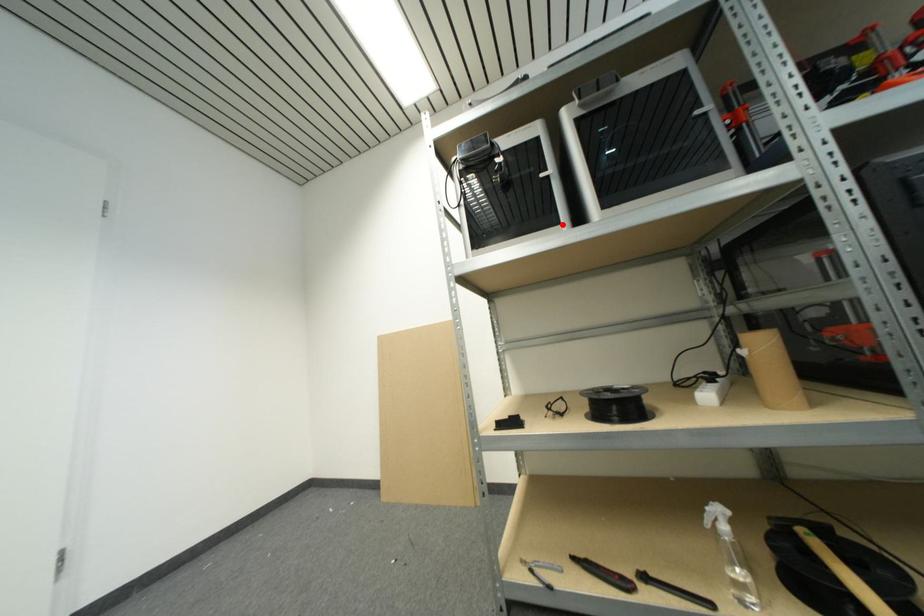
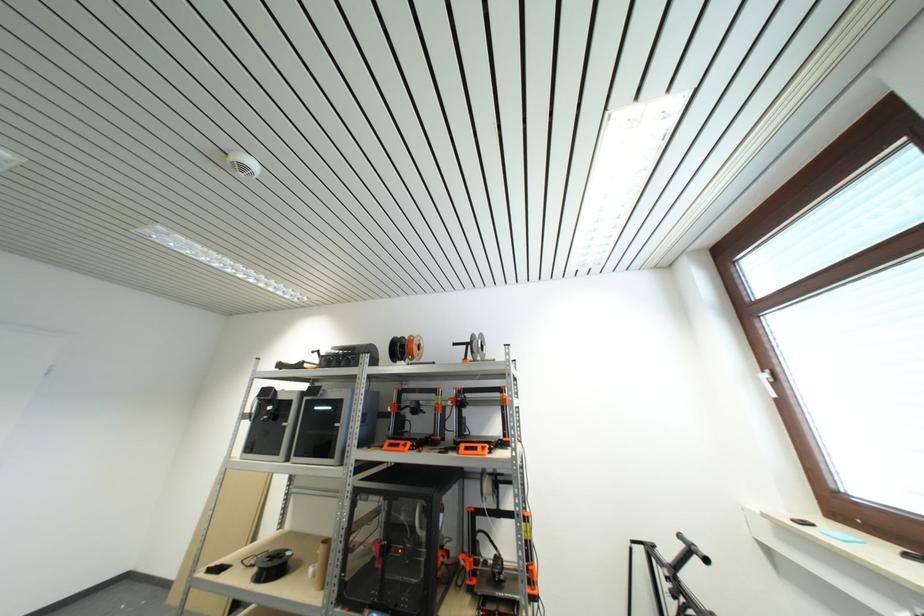
In the second image, find the point that corresponds to the highlighted location in the first image.

(283, 456)